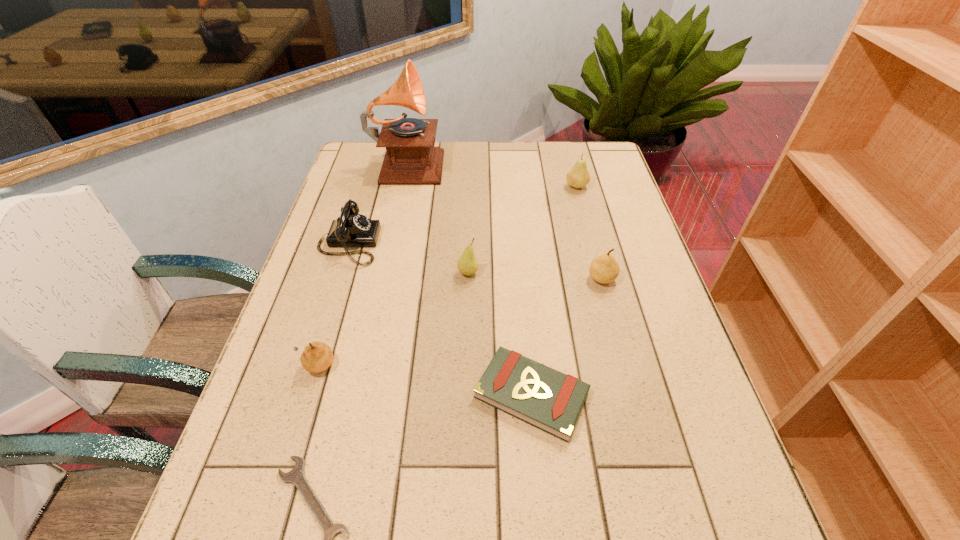
Find the location of a particular element. This screenshot has width=960, height=540. free spot at the right edge of the desktop is located at coordinates (743, 515).

I want to click on vacant region at the far left corner of the desktop, so click(x=347, y=162).

The height and width of the screenshot is (540, 960). I want to click on free location at the near left corner, so click(206, 531).

Image resolution: width=960 pixels, height=540 pixels. In order to click on free spot between the sixth tallest object and the farthest pear in this screenshot , I will do `click(445, 276)`.

The height and width of the screenshot is (540, 960). I want to click on free space between the telephone and the shortest pear, so click(332, 305).

I want to click on unoccupied position between the telephone and the farthest pear, so click(463, 215).

Locate an element on the screen. Image resolution: width=960 pixels, height=540 pixels. vacant region between the telephone and the leftmost pear is located at coordinates (332, 305).

Identify which object is the sixth closest to the nearest object. Please provide its 2D coordinates. Your answer should be formatted as a tuple, i.e. [(x, y)], where the tuple contains the x and y coordinates of a point satisfying the conditions above.

[(411, 158)]

Point out which object is positioned as the third nearest to the second pear from left to right. Please provide its 2D coordinates. Your answer should be formatted as a tuple, i.e. [(x, y)], where the tuple contains the x and y coordinates of a point satisfying the conditions above.

[(604, 269)]

Where is `pear that is the second nearest to the second shortest object`? pear that is the second nearest to the second shortest object is located at coordinates (467, 264).